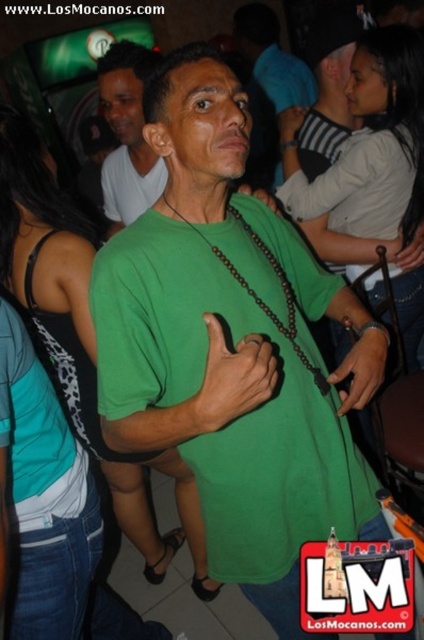
Is green matte shirt at center bigger than matte black shirt at center?

Indeed, green matte shirt at center has a larger size compared to matte black shirt at center.

Looking at this image, is green matte shirt at center to the left of matte black shirt at center from the viewer's perspective?

Incorrect, green matte shirt at center is not on the left side of matte black shirt at center.

Which is in front, point (183, 324) or point (106, 74)?

Point (183, 324) is in front.

Locate an element on the screen. The image size is (424, 640). green matte shirt at center is located at coordinates (233, 348).